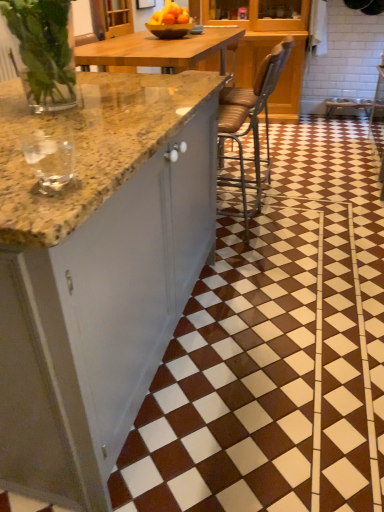
Find the location of `brown glossy tile at center`. brown glossy tile at center is located at coordinates (277, 349).

I want to click on tile on the left of brown leather chair at center, so click(x=277, y=349).

Is brown leather chair at center not near brown glossy tile at center?

Actually, brown leather chair at center and brown glossy tile at center are a little close together.

Considering the sizes of objects brown leather chair at center and brown glossy tile at center in the image provided, who is smaller, brown leather chair at center or brown glossy tile at center?

brown leather chair at center.

Is brown leather chair at center positioned with its back to brown glossy tile at center?

No, brown leather chair at center is not facing the opposite direction of brown glossy tile at center.

Which point is more forward, (x=61, y=174) or (x=309, y=468)?

Positioned in front is point (x=61, y=174).

Does clear glass wine glass at left have a smaller size compared to brown glossy tile at center?

Yes, clear glass wine glass at left is smaller than brown glossy tile at center.

Is clear glass wine glass at left oriented towards brown glossy tile at center?

No, clear glass wine glass at left is not turned towards brown glossy tile at center.

Would you say clear glass wine glass at left is outside brown glossy tile at center?

Absolutely, clear glass wine glass at left is external to brown glossy tile at center.

From the image's perspective, would you say brown glossy tile at center is shown under clear glass wine glass at left?

No.

Visually, is brown glossy tile at center positioned to the left or to the right of clear glass wine glass at left?

brown glossy tile at center is positioned on clear glass wine glass at left's right side.

What's the angular difference between brown glossy tile at center and clear glass wine glass at left's facing directions?

The facing directions of brown glossy tile at center and clear glass wine glass at left are 91.4 degrees apart.

From a real-world perspective, is brown leather chair at center positioned under clear glass wine glass at left based on gravity?

Yes, from a real-world perspective, brown leather chair at center is below clear glass wine glass at left.

Does point (247, 211) come closer to viewer compared to point (65, 182)?

No, it is not.

In terms of width, does brown leather chair at center look wider or thinner when compared to clear glass wine glass at left?

In the image, brown leather chair at center appears to be wider than clear glass wine glass at left.

Considering the positions of objects brown leather chair at center and clear glass wine glass at left in the image provided, who is more to the right, brown leather chair at center or clear glass wine glass at left?

brown leather chair at center.

Is brown leather chair at center inside clear glass wine glass at left?

Definitely not — brown leather chair at center is not inside clear glass wine glass at left.

From a real-world perspective, relative to brown leather chair at center, is clear glass wine glass at left vertically above or below?

Clearly, from a real-world perspective, clear glass wine glass at left is above brown leather chair at center.

Is clear glass wine glass at left facing away from brown leather chair at center?

No.

Can you confirm if clear glass wine glass at left is taller than brown leather chair at center?

No.

Between brown glossy tile at center and brown leather chair at center, which one has larger size?

brown glossy tile at center.

From a real-world perspective, does brown glossy tile at center stand above brown leather chair at center?

No, from a real-world perspective, brown glossy tile at center is not on top of brown leather chair at center.

Is brown leather chair at center a part of brown glossy tile at center?

No, brown glossy tile at center does not contain brown leather chair at center.

Looking at their sizes, would you say brown glossy tile at center is wider or thinner than brown leather chair at center?

In the image, brown glossy tile at center appears to be wider than brown leather chair at center.

At what (x,y) coordinates should I click in order to perform the action: click on chair positioned vertically above the brown glossy tile at center (from a real-world perspective). Please return your answer as a coordinate pair (x, y). Looking at the image, I should click on (251, 119).

Find the location of a particular element. The height and width of the screenshot is (512, 384). wine glass in front of the brown glossy tile at center is located at coordinates (49, 155).

Based on their spatial positions, is clear glass wine glass at left or brown glossy tile at center further from brown leather chair at center?

The object further to brown leather chair at center is clear glass wine glass at left.

When comparing their distances from clear glass wine glass at left, does brown glossy tile at center or brown leather chair at center seem further?

The object further to clear glass wine glass at left is brown leather chair at center.

From the image, which object appears to be nearer to brown leather chair at center, brown glossy tile at center or clear glass wine glass at left?

brown glossy tile at center is closer to brown leather chair at center.

Which object lies further to the anchor point brown glossy tile at center, brown leather chair at center or clear glass wine glass at left?

Result: Based on the image, clear glass wine glass at left appears to be further to brown glossy tile at center.

Looking at the image, which one is located closer to brown glossy tile at center, clear glass wine glass at left or brown leather chair at center?

brown leather chair at center.

Based on their spatial positions, is brown leather chair at center or brown glossy tile at center closer to clear glass wine glass at left?

brown glossy tile at center lies closer to clear glass wine glass at left than the other object.

The image size is (384, 512). I want to click on tile between clear glass wine glass at left and brown leather chair at center along the z-axis, so click(x=277, y=349).